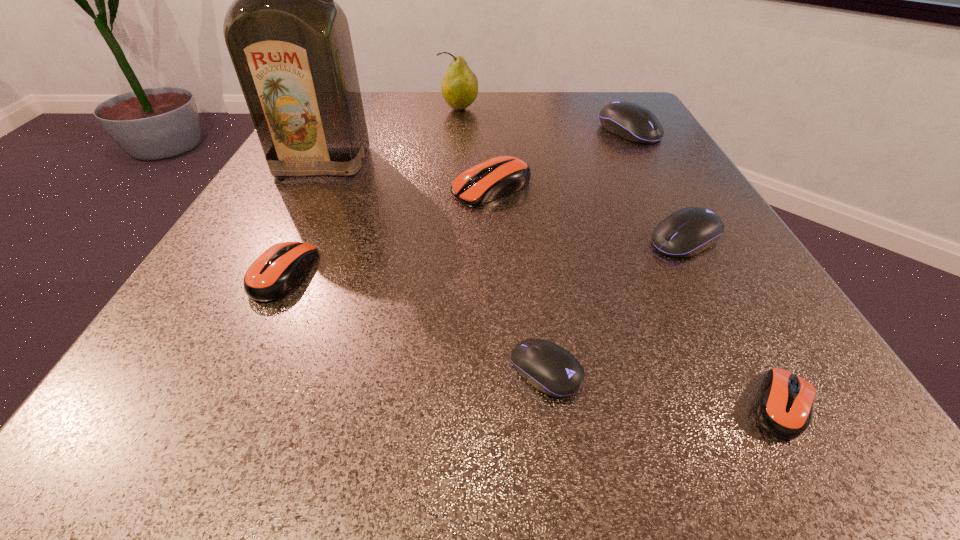
This screenshot has width=960, height=540. I want to click on vacant space that's between the farthest orange computer mouse and the tallest computer mouse, so click(561, 159).

Locate an element on the screen. free area in between the farthest orange computer mouse and the second nearest orange computer mouse is located at coordinates (388, 231).

Identify the location of unoccupied position between the biggest black computer mouse and the second smallest black computer mouse. The width and height of the screenshot is (960, 540). (657, 185).

Select which object appears as the closest to the nearest orange computer mouse. Please provide its 2D coordinates. Your answer should be formatted as a tuple, i.e. [(x, y)], where the tuple contains the x and y coordinates of a point satisfying the conditions above.

[(551, 369)]

Point out which object is positioned as the second nearest to the nearest black computer mouse. Please provide its 2D coordinates. Your answer should be formatted as a tuple, i.e. [(x, y)], where the tuple contains the x and y coordinates of a point satisfying the conditions above.

[(691, 230)]

At what (x,y) coordinates should I click in order to perform the action: click on computer mouse that can be found as the second closest to the nearest black computer mouse. Please return your answer as a coordinate pair (x, y). The height and width of the screenshot is (540, 960). Looking at the image, I should click on (691, 230).

Identify which computer mouse is the third nearest to the pear. Please provide its 2D coordinates. Your answer should be formatted as a tuple, i.e. [(x, y)], where the tuple contains the x and y coordinates of a point satisfying the conditions above.

[(691, 230)]

Locate an element on the screen. black computer mouse that is the nearest to the smallest black computer mouse is located at coordinates (691, 230).

Locate which black computer mouse is the second closest to the second smallest black computer mouse. Please provide its 2D coordinates. Your answer should be formatted as a tuple, i.e. [(x, y)], where the tuple contains the x and y coordinates of a point satisfying the conditions above.

[(630, 121)]

I want to click on orange computer mouse identified as the closest to the second farthest orange computer mouse, so pyautogui.click(x=496, y=177).